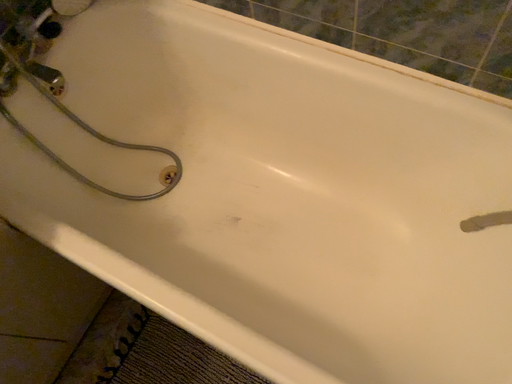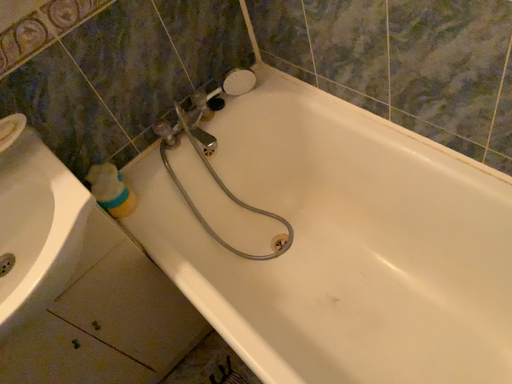
Question: Which way did the camera rotate in the video?

Choices:
 (A) rotated right
 (B) rotated left

Answer: (B)